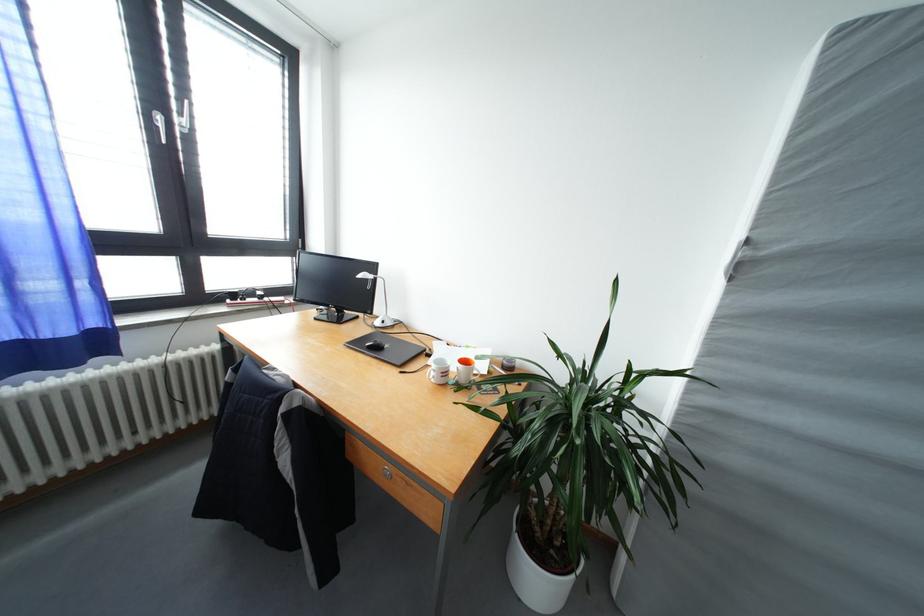
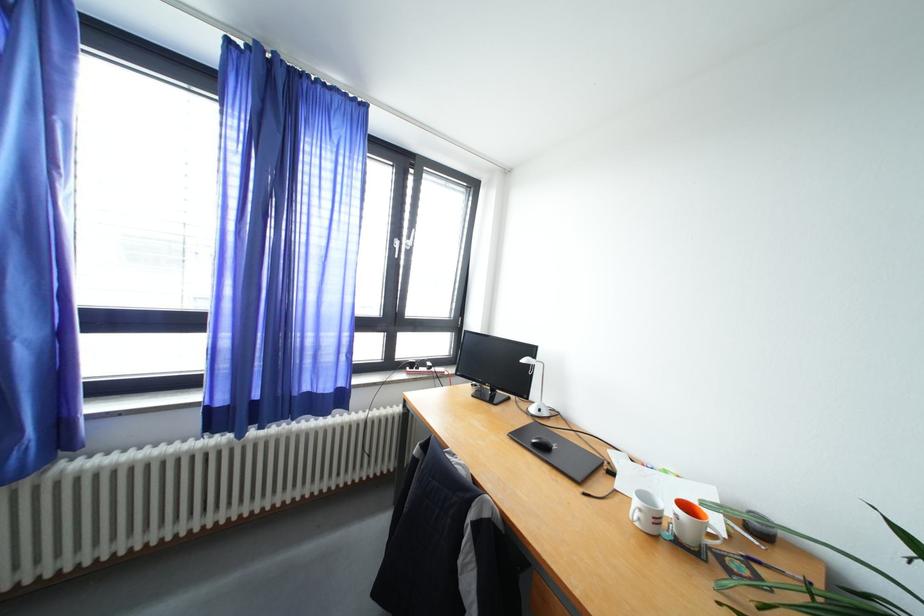
Locate, in the second image, the point that corresponds to point 377,353 in the first image.

(541, 450)